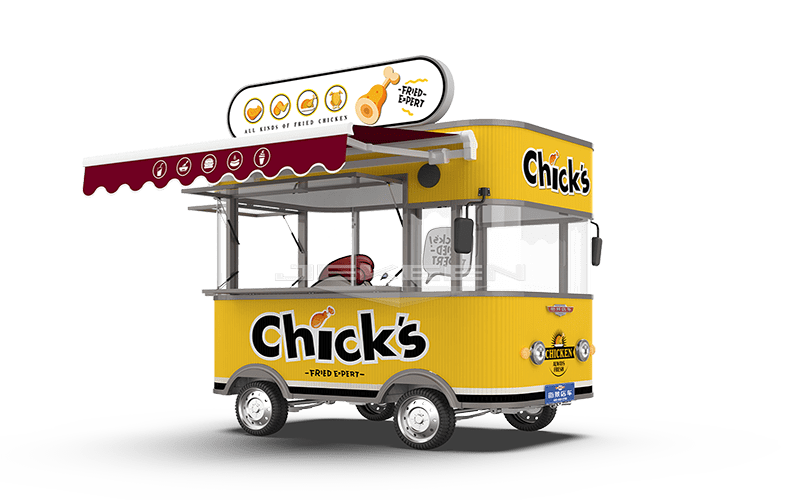
Locate an element on the screen. The width and height of the screenshot is (800, 500). window is located at coordinates (521, 270).